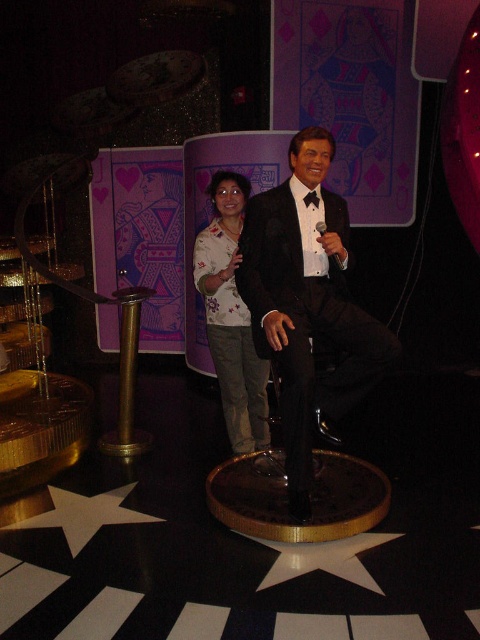
Question: Is shiny black suit at center bigger than floral shirt at center?

Choices:
 (A) yes
 (B) no

Answer: (B)

Question: Is floral shirt at center thinner than black plastic microphone at center?

Choices:
 (A) no
 (B) yes

Answer: (A)

Question: Among these objects, which one is farthest from the camera?

Choices:
 (A) black plastic microphone at center
 (B) floral shirt at center

Answer: (B)

Question: Which of the following is the farthest from the observer?

Choices:
 (A) shiny black suit at center
 (B) floral shirt at center
 (C) black plastic microphone at center

Answer: (B)

Question: Does shiny black suit at center appear under floral shirt at center?

Choices:
 (A) no
 (B) yes

Answer: (B)

Question: Which is nearer to the shiny black suit at center?

Choices:
 (A) black plastic microphone at center
 (B) floral shirt at center

Answer: (A)